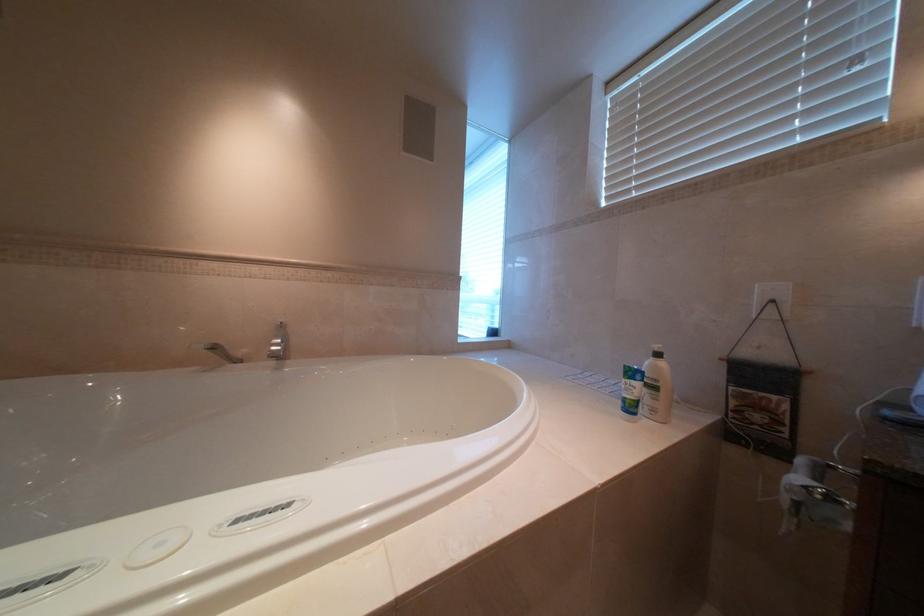
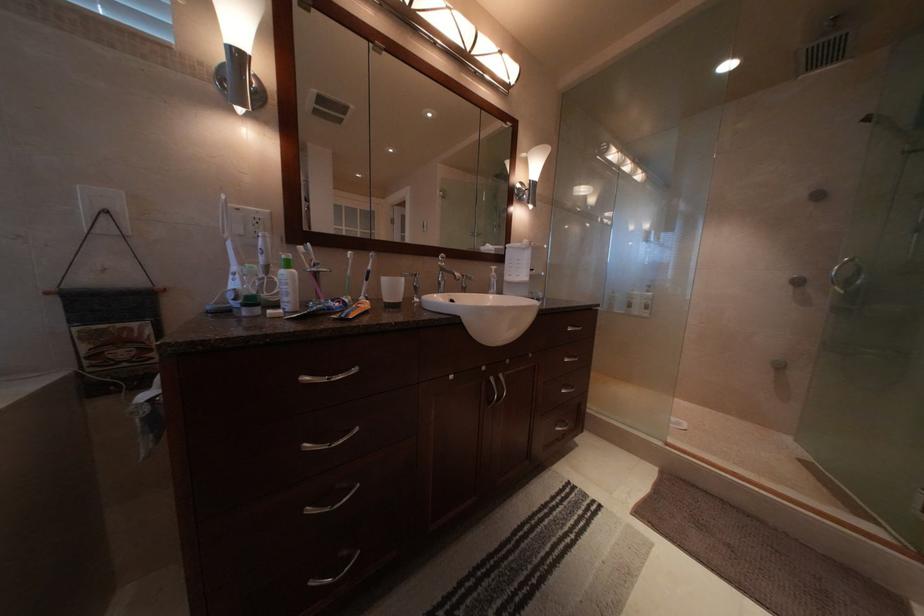
Question: The images are taken continuously from a first-person perspective. In which direction is your viewpoint rotating?

Choices:
 (A) Left
 (B) Right
 (C) Up
 (D) Down

Answer: (B)